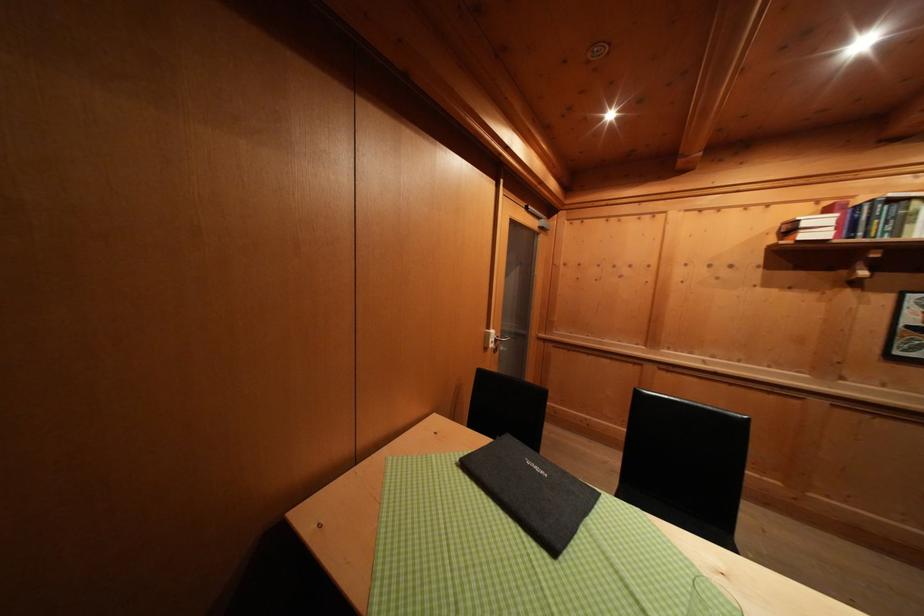
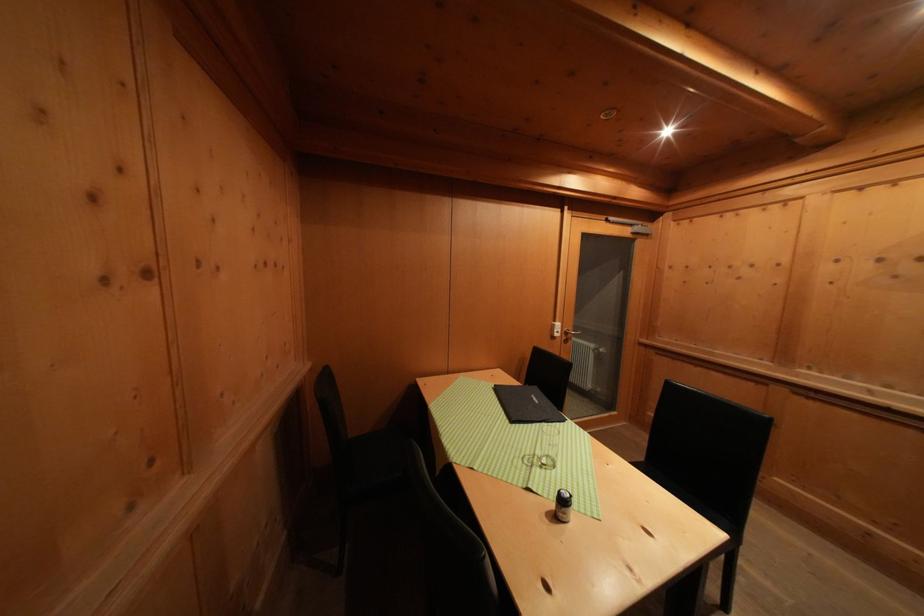
Find the pixel in the second image that matches [499,338] in the first image.

(564, 330)